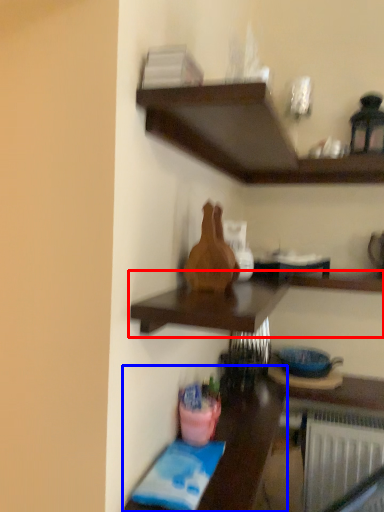
Question: Which point is closer to the camera, shelf (highlighted by a red box) or table (highlighted by a blue box)?

Choices:
 (A) shelf
 (B) table

Answer: (A)